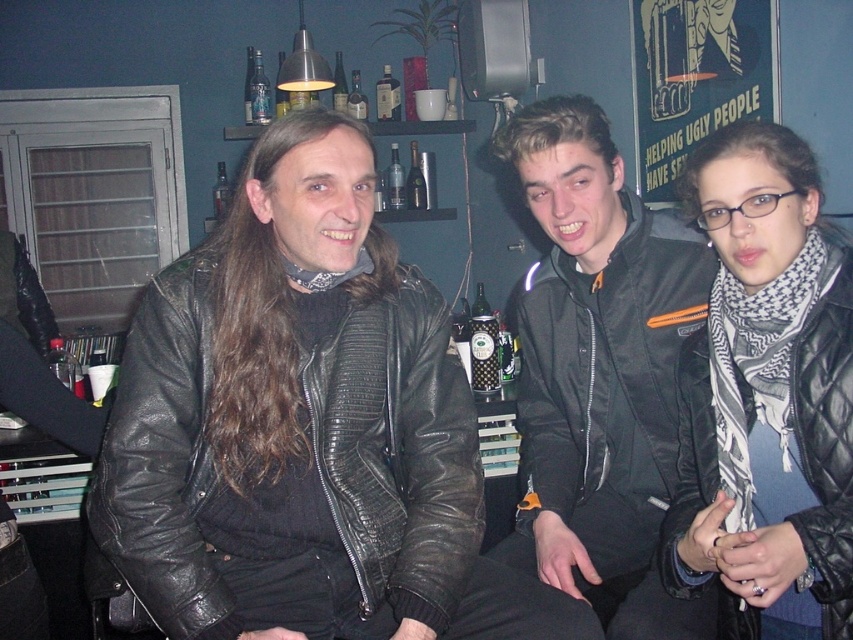
Is black leather jacket at left below black leather jacket at center?

Yes, black leather jacket at left is below black leather jacket at center.

Can you confirm if black leather jacket at left is positioned to the right of black leather jacket at center?

No, black leather jacket at left is not to the right of black leather jacket at center.

Which is behind, point (404, 387) or point (596, 372)?

The point (596, 372) is more distant.

You are a GUI agent. You are given a task and a screenshot of the screen. Output one action in this format:
    pyautogui.click(x=<x>, y=<y>)
    Task: Click on the black leather jacket at left
    The image size is (853, 640).
    Given the screenshot: What is the action you would take?
    pyautogui.click(x=397, y=449)

From the picture: Is black quilted jacket at center shorter than black leather jacket at center?

Indeed, black quilted jacket at center has a lesser height compared to black leather jacket at center.

Which of these two, black quilted jacket at center or black leather jacket at center, stands shorter?

Standing shorter between the two is black quilted jacket at center.

Where is `black quilted jacket at center`? This screenshot has width=853, height=640. black quilted jacket at center is located at coordinates (766, 396).

Which is behind, point (426, 620) or point (839, 436)?

The point (426, 620) is behind.

Is black leather jacket at left positioned at the back of black quilted jacket at center?

That is True.

Locate an element on the screen. The image size is (853, 640). black leather jacket at left is located at coordinates (397, 449).